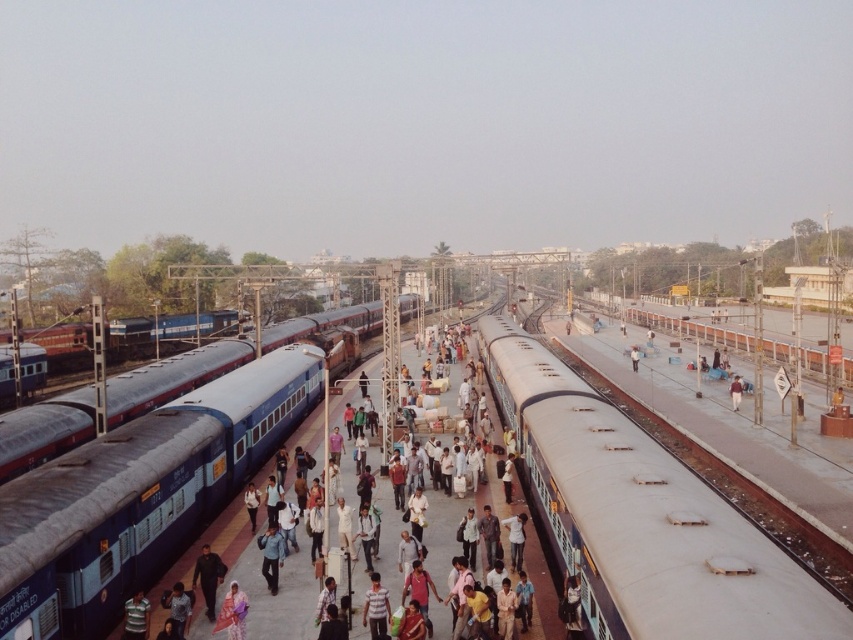
Is silver metallic train at center behind metallic silver helmet at center?

No, silver metallic train at center is closer to the viewer.

Can you confirm if silver metallic train at center is positioned to the right of metallic silver helmet at center?

Correct, you'll find silver metallic train at center to the right of metallic silver helmet at center.

Does point (648, 630) come behind point (142, 632)?

No.

Locate an element on the screen. The image size is (853, 640). silver metallic train at center is located at coordinates (642, 516).

Who is shorter, blue metallic train at center or metallic silver helmet at center?

With less height is metallic silver helmet at center.

Which is more to the left, blue metallic train at center or metallic silver helmet at center?

blue metallic train at center is more to the left.

I want to click on blue metallic train at center, so click(171, 378).

Does metallic silver helmet at center appear on the left side of brown fabric bag at center?

Correct, you'll find metallic silver helmet at center to the left of brown fabric bag at center.

You are a GUI agent. You are given a task and a screenshot of the screen. Output one action in this format:
    pyautogui.click(x=<x>, y=<y>)
    Task: Click on the metallic silver helmet at center
    This screenshot has width=853, height=640.
    Given the screenshot: What is the action you would take?
    pyautogui.click(x=136, y=616)